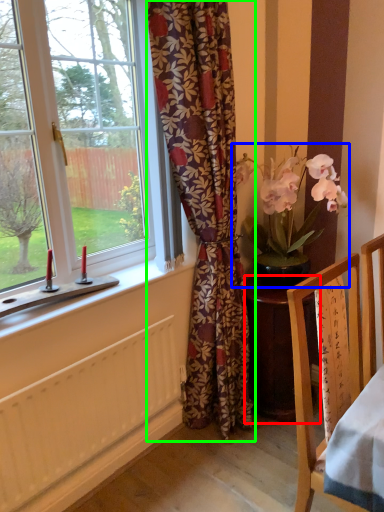
Question: Based on their relative distances, which object is farther from desk (highlighted by a red box)? Choose from houseplant (highlighted by a blue box) and curtain (highlighted by a green box).

Choices:
 (A) houseplant
 (B) curtain

Answer: (A)